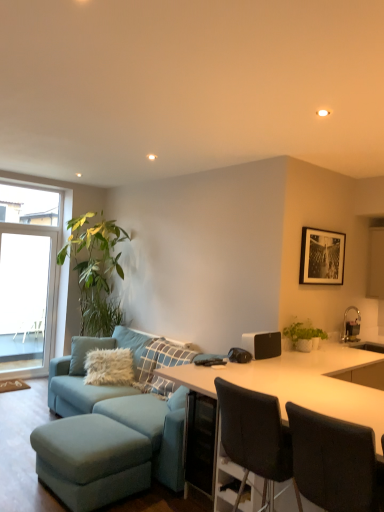
Question: Is black paper at upper center taller than matte blue ottoman at lower left?

Choices:
 (A) yes
 (B) no

Answer: (A)

Question: Is black paper at upper center wider than matte blue ottoman at lower left?

Choices:
 (A) yes
 (B) no

Answer: (B)

Question: Does black paper at upper center have a lesser width compared to matte blue ottoman at lower left?

Choices:
 (A) yes
 (B) no

Answer: (A)

Question: From a real-world perspective, does black paper at upper center sit lower than matte blue ottoman at lower left?

Choices:
 (A) no
 (B) yes

Answer: (A)

Question: Can you confirm if black paper at upper center is shorter than matte blue ottoman at lower left?

Choices:
 (A) no
 (B) yes

Answer: (A)

Question: From the image's perspective, is white matte speaker at center above or below black paper at upper center?

Choices:
 (A) below
 (B) above

Answer: (A)

Question: In the image, is white matte speaker at center positioned in front of or behind black paper at upper center?

Choices:
 (A) front
 (B) behind

Answer: (A)

Question: In terms of width, does white matte speaker at center look wider or thinner when compared to black paper at upper center?

Choices:
 (A) wide
 (B) thin

Answer: (A)

Question: In terms of height, does white matte speaker at center look taller or shorter compared to black paper at upper center?

Choices:
 (A) short
 (B) tall

Answer: (A)

Question: Is transparent glass window at left situated inside matte blue fabric couch at lower left or outside?

Choices:
 (A) outside
 (B) inside

Answer: (A)

Question: Considering the positions of transparent glass window at left and matte blue fabric couch at lower left in the image, is transparent glass window at left taller or shorter than matte blue fabric couch at lower left?

Choices:
 (A) short
 (B) tall

Answer: (B)

Question: Based on their positions, is transparent glass window at left located to the left or right of matte blue fabric couch at lower left?

Choices:
 (A) right
 (B) left

Answer: (B)

Question: In the image, is transparent glass window at left positioned in front of or behind matte blue fabric couch at lower left?

Choices:
 (A) front
 (B) behind

Answer: (B)

Question: From their relative heights in the image, would you say black fabric chair at lower right, acting as the second chair starting from the front, is taller or shorter than white fluffy pillow at center?

Choices:
 (A) short
 (B) tall

Answer: (B)

Question: Considering the positions of point (271, 457) and point (175, 351), is point (271, 457) closer or farther from the camera than point (175, 351)?

Choices:
 (A) farther
 (B) closer

Answer: (B)